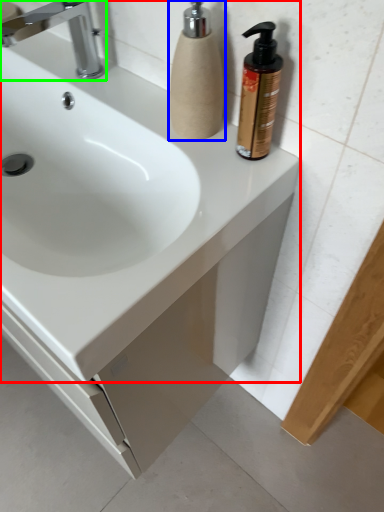
Question: Estimate the real-world distances between objects in this image. Which object is farther from sink (highlighted by a red box), soap dispenser (highlighted by a blue box) or tap (highlighted by a green box)?

Choices:
 (A) soap dispenser
 (B) tap

Answer: (B)